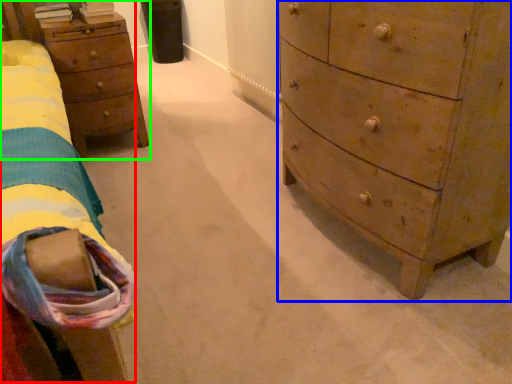
Question: Considering the real-world distances, which object is farthest from bed (highlighted by a red box)? chest of drawers (highlighted by a blue box) or nightstand (highlighted by a green box)?

Choices:
 (A) chest of drawers
 (B) nightstand

Answer: (A)